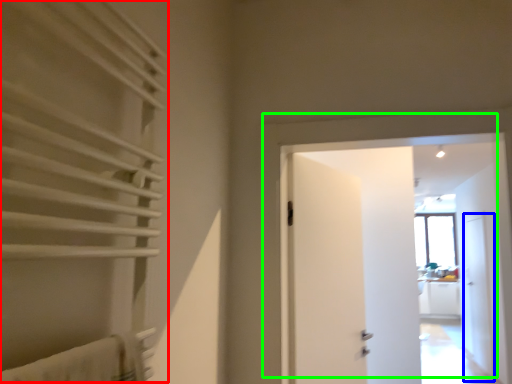
Question: Which object is positioned closest to curtain (highlighted by a red box)? Select from screen door (highlighted by a blue box) and door (highlighted by a green box).

Choices:
 (A) screen door
 (B) door

Answer: (B)